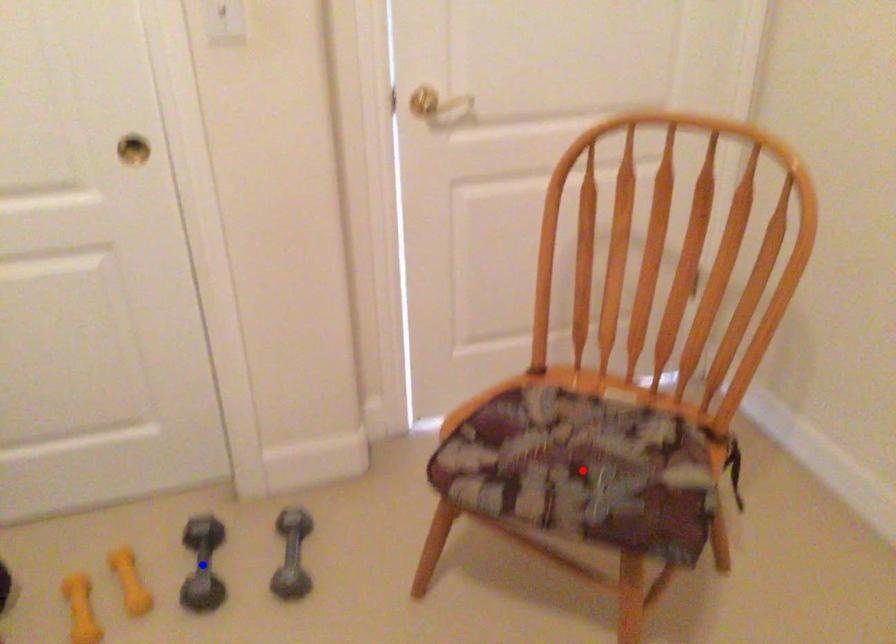
Question: Which of the two points in the image is closer to the camera?

Choices:
 (A) Blue point is closer.
 (B) Red point is closer.

Answer: (B)